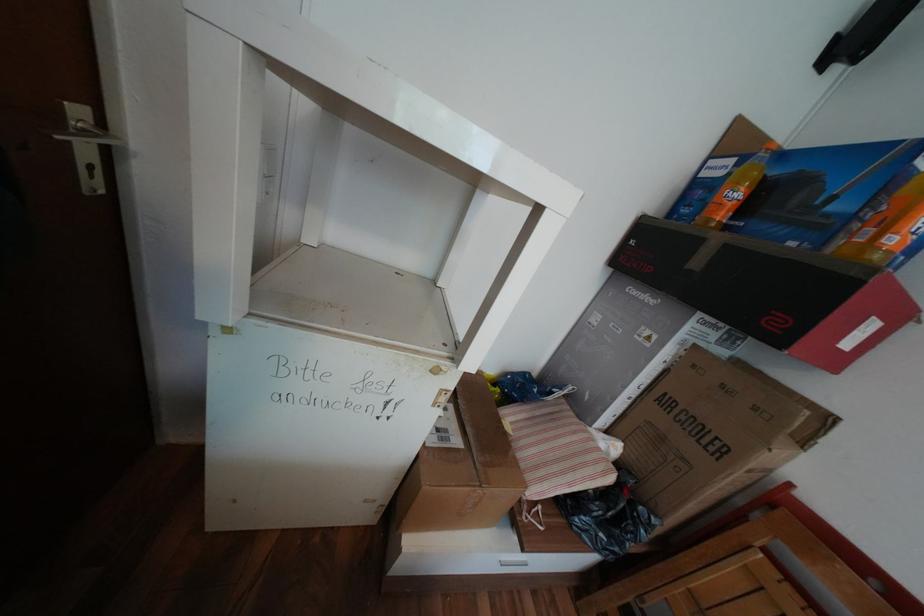
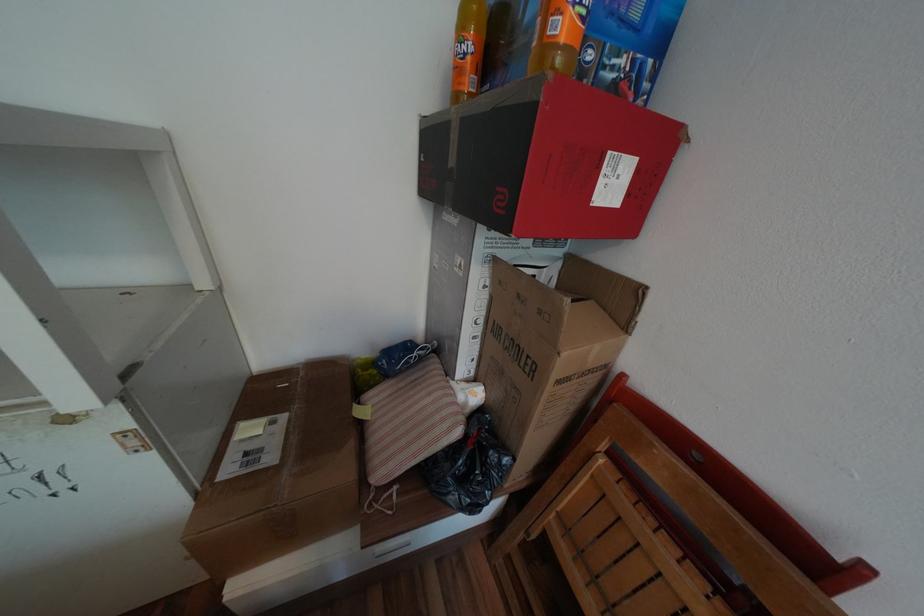
The point at (764,408) is marked in the first image. Where is the corresponding point in the second image?

(550, 312)